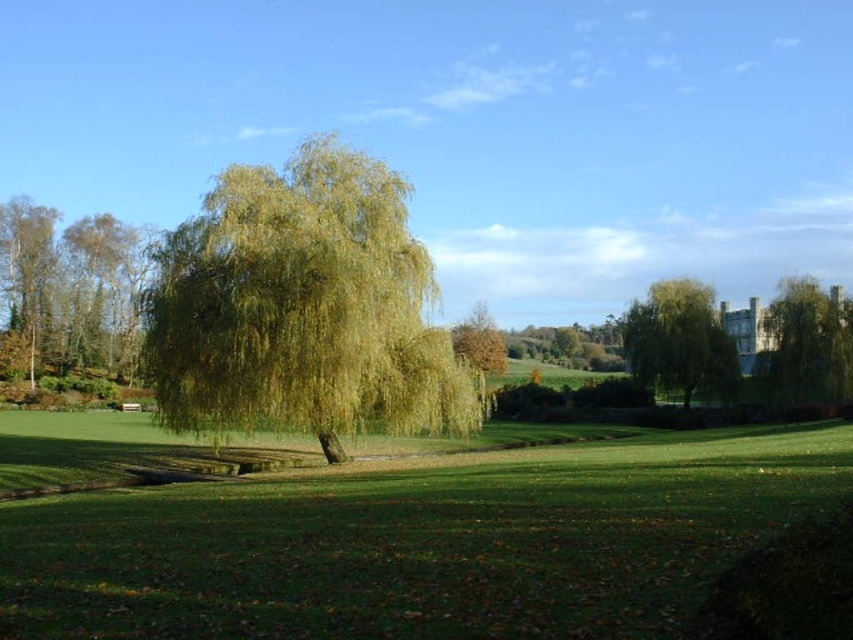
You are a landscape architect planning to install a new bench in the park. You want to place it equidistant between the green leafy willow at center and the green leafy tree at center. What is the minimum distance you need to walk from the willow to reach the bench?

The green leafy willow at center and green leafy tree at center are 35.66 meters apart. To place the bench equidistant between them, you would need to walk half of that distance, which is 17.83 meters from the willow to reach the bench.

You are standing at the center of the park and want to find the green leafy willow at center. According to the coordinates provided, in which direction should you walk to reach it?

The green leafy willow at center is located at coordinates point (303, 308). Since you are at the center of the park, you should walk towards the center to reach it because its coordinates are very close to the center point.